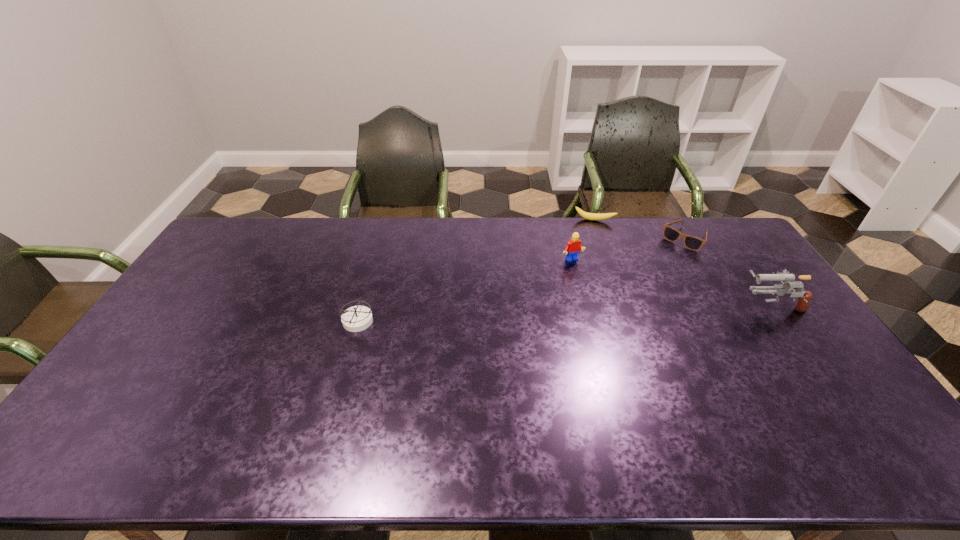
Locate an element on the screen. The height and width of the screenshot is (540, 960). free space located at the barrel end of the gun is located at coordinates (676, 306).

The width and height of the screenshot is (960, 540). I want to click on free point located on the front-facing side of the second tallest object, so click(x=625, y=328).

The width and height of the screenshot is (960, 540). Find the location of `free space located on the front-facing side of the second tallest object`. free space located on the front-facing side of the second tallest object is located at coordinates (608, 306).

This screenshot has width=960, height=540. Find the location of `blank area located on the front-facing side of the second tallest object`. blank area located on the front-facing side of the second tallest object is located at coordinates (587, 278).

Where is `vacant space located 0.280m on the upward curve of the third object from right to left`? The image size is (960, 540). vacant space located 0.280m on the upward curve of the third object from right to left is located at coordinates (589, 267).

You are a GUI agent. You are given a task and a screenshot of the screen. Output one action in this format:
    pyautogui.click(x=<x>, y=<y>)
    Task: Click on the free space located 0.300m on the upward curve of the third object from right to left
    
    Given the screenshot: What is the action you would take?
    pyautogui.click(x=588, y=271)

You are a GUI agent. You are given a task and a screenshot of the screen. Output one action in this format:
    pyautogui.click(x=<x>, y=<y>)
    Task: Click on the free space located 0.300m on the upward curve of the third object from right to left
    The image size is (960, 540).
    Given the screenshot: What is the action you would take?
    pyautogui.click(x=588, y=271)

Locate an element on the screen. free spot located 0.280m on the frames of the fourth nearest object is located at coordinates (x=639, y=286).

Locate an element on the screen. vacant area located on the frames of the fourth nearest object is located at coordinates (643, 282).

You are a GUI agent. You are given a task and a screenshot of the screen. Output one action in this format:
    pyautogui.click(x=<x>, y=<y>)
    Task: Click on the vacant space situated on the frames of the fourth nearest object
    The width and height of the screenshot is (960, 540).
    Given the screenshot: What is the action you would take?
    (662, 262)